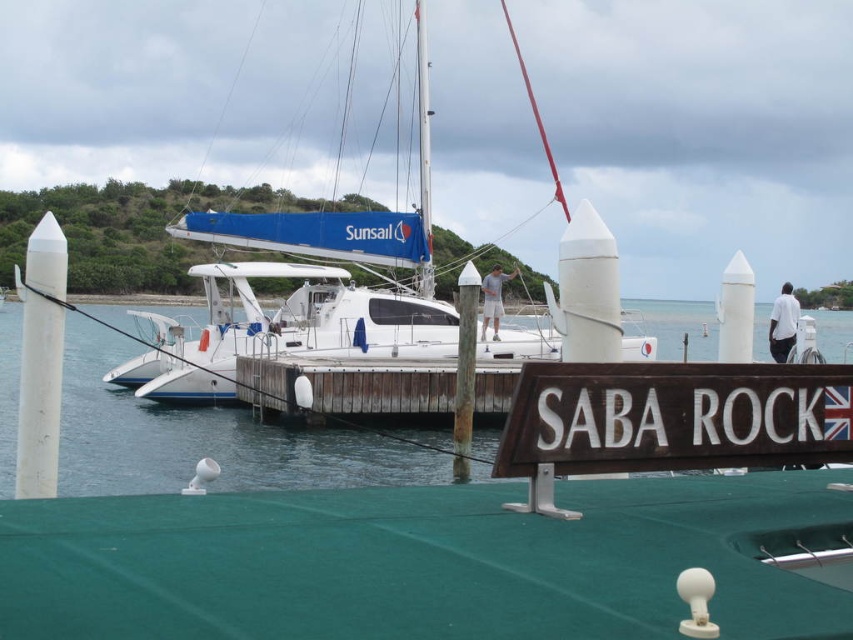
Question: Which of the following is the farthest from the observer?

Choices:
 (A) (163, 348)
 (B) (827, 356)
 (C) (410, 372)
 (D) (556, 433)

Answer: (B)

Question: Does clear blue water at center appear under brown wooden sign at lower center?

Choices:
 (A) no
 (B) yes

Answer: (A)

Question: Is clear blue water at center bigger than white glossy catamaran at center?

Choices:
 (A) no
 (B) yes

Answer: (A)

Question: Estimate the real-world distances between objects in this image. Which object is closer to the white glossy catamaran at center?

Choices:
 (A) brown wooden dock at center
 (B) brown wooden sign at lower center

Answer: (B)

Question: Based on their relative distances, which object is farther from the white glossy catamaran at center?

Choices:
 (A) brown wooden sign at lower center
 (B) brown wooden dock at center

Answer: (B)

Question: Is clear blue water at center thinner than white glossy catamaran at center?

Choices:
 (A) no
 (B) yes

Answer: (A)